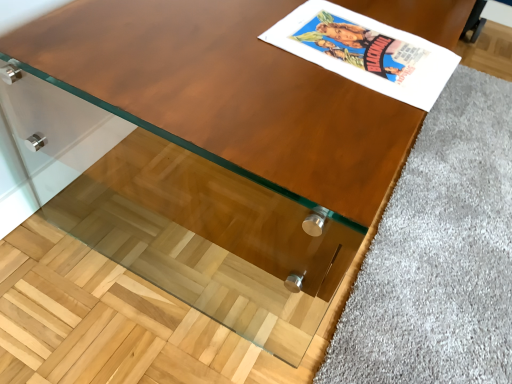
Question: Is soft gray carpet at lower right at the left side of matte paper comic book at upper right?

Choices:
 (A) no
 (B) yes

Answer: (A)

Question: From a real-world perspective, is soft gray carpet at lower right below matte paper comic book at upper right?

Choices:
 (A) yes
 (B) no

Answer: (A)

Question: Can we say soft gray carpet at lower right lies outside matte paper comic book at upper right?

Choices:
 (A) no
 (B) yes

Answer: (B)

Question: From the image's perspective, is soft gray carpet at lower right located beneath matte paper comic book at upper right?

Choices:
 (A) yes
 (B) no

Answer: (A)

Question: Is soft gray carpet at lower right wider than matte paper comic book at upper right?

Choices:
 (A) no
 (B) yes

Answer: (B)

Question: Is soft gray carpet at lower right smaller than matte paper comic book at upper right?

Choices:
 (A) yes
 (B) no

Answer: (B)

Question: Does matte paper comic book at upper right have a greater width compared to soft gray carpet at lower right?

Choices:
 (A) yes
 (B) no

Answer: (B)

Question: Could you tell me if matte paper comic book at upper right is turned towards soft gray carpet at lower right?

Choices:
 (A) yes
 (B) no

Answer: (B)

Question: From a real-world perspective, is matte paper comic book at upper right on top of soft gray carpet at lower right?

Choices:
 (A) no
 (B) yes

Answer: (B)

Question: Is matte paper comic book at upper right thinner than soft gray carpet at lower right?

Choices:
 (A) no
 (B) yes

Answer: (B)

Question: From the image's perspective, does matte paper comic book at upper right appear lower than soft gray carpet at lower right?

Choices:
 (A) yes
 (B) no

Answer: (B)

Question: Would you say matte paper comic book at upper right is a long distance from soft gray carpet at lower right?

Choices:
 (A) yes
 (B) no

Answer: (B)

Question: Considering the positions of soft gray carpet at lower right and matte paper comic book at upper right in the image, is soft gray carpet at lower right taller or shorter than matte paper comic book at upper right?

Choices:
 (A) tall
 (B) short

Answer: (B)